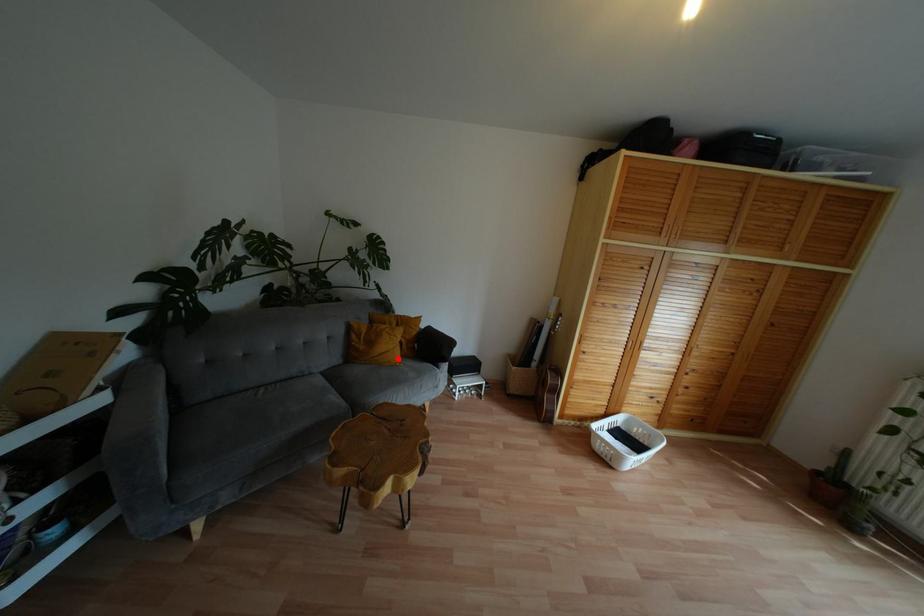
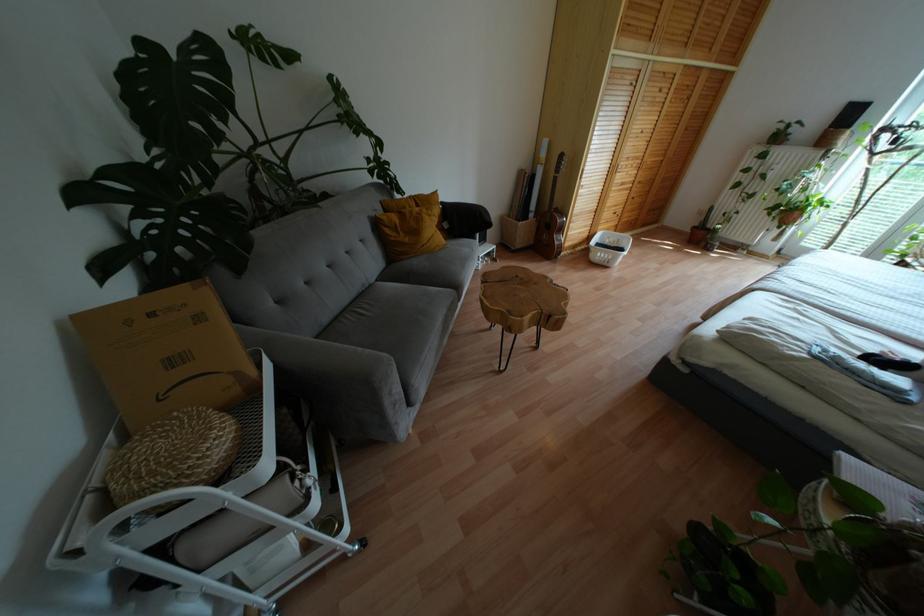
Locate, in the second image, the point that corresponds to the highlighted location in the first image.

(443, 240)